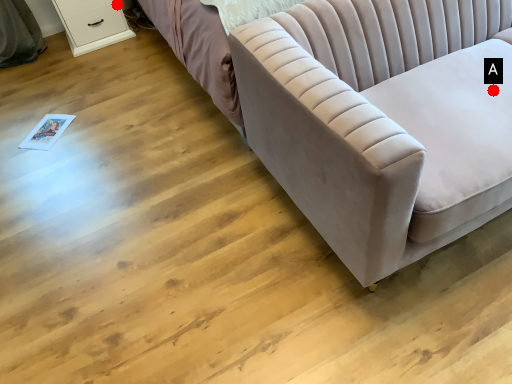
Question: Two points are circled on the image, labeled by A and B beside each circle. Which point is further to the camera?

Choices:
 (A) A is further
 (B) B is further

Answer: (B)